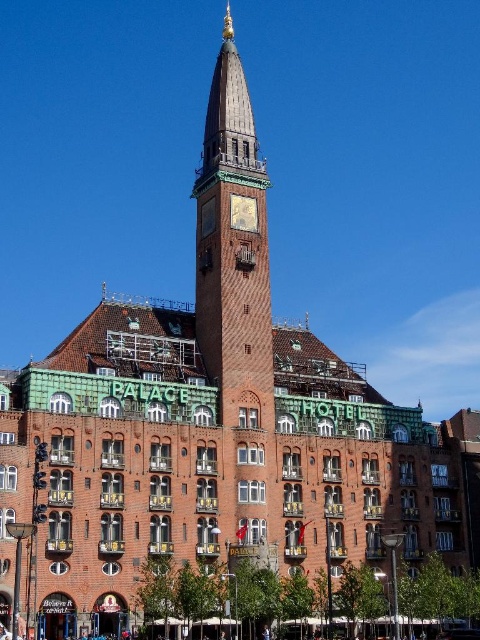
You are standing in front of the palace and notice two central features. The brown textured clock tower at center and the goldmetallicclock at center. Which one is positioned to the left?

The brown textured clock tower at center is positioned to the left of the goldmetallicclock at center.

You are standing in front of the palace and notice two points marked on the tower. The first point is at coordinates point [247,349] and the second is at point [244,205]. Which of these points is closer to you?

Point [247,349] is in front of point [244,205], so it is closer to you.

You are an architect designing a scale model of the palace. You have a 10cm space allocated for the clock tower and its components. The goldmetallicclock at center must be placed on top of the brown textured clock tower at center. Can you fit both within the 10cm height limit?

The brown textured clock tower at center is larger than the goldmetallicclock at center. If the total height of both combined exceeds 10cm, they won